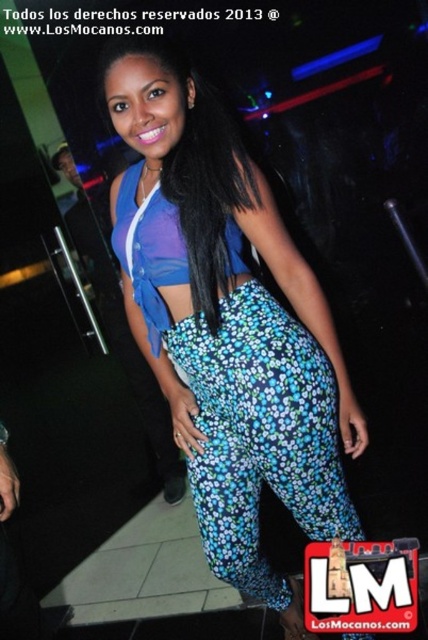
Question: Can you confirm if floral printed pants at center is positioned to the left of floral print pants at center?

Choices:
 (A) yes
 (B) no

Answer: (A)

Question: Can you confirm if floral printed pants at center is wider than floral print pants at center?

Choices:
 (A) yes
 (B) no

Answer: (A)

Question: Considering the real-world distances, which object is farthest from the floral print pants at center?

Choices:
 (A) floral printed pants at center
 (B) black silky hair at center

Answer: (B)

Question: Can you confirm if floral printed pants at center is thinner than black silky hair at center?

Choices:
 (A) yes
 (B) no

Answer: (B)

Question: Which of the following is the farthest from the observer?

Choices:
 (A) floral print pants at center
 (B) floral printed pants at center

Answer: (A)

Question: Which of these objects is positioned closest to the black silky hair at center?

Choices:
 (A) floral print pants at center
 (B) floral printed pants at center

Answer: (B)